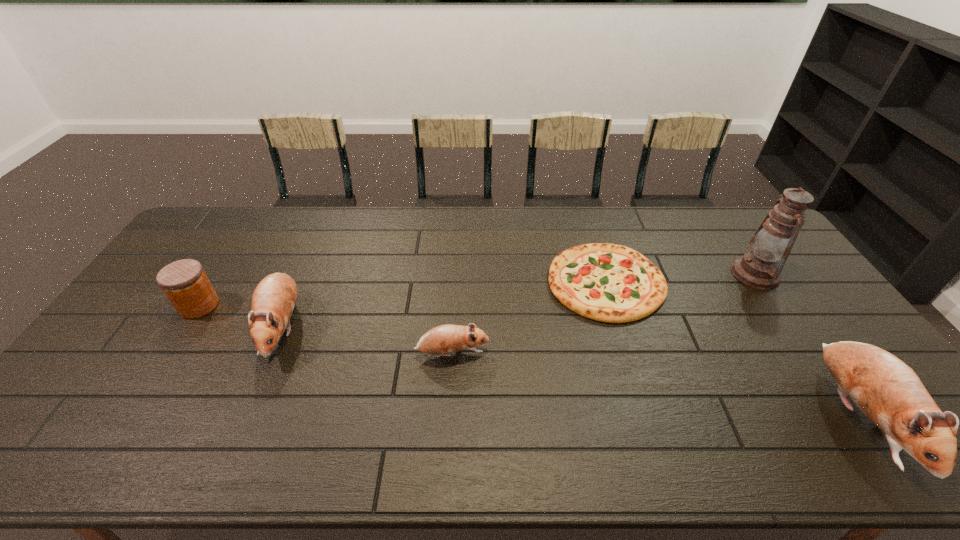
What are the coordinates of `free region located 0.270m at the face of the second shortest object` in the screenshot? It's located at (588, 353).

The width and height of the screenshot is (960, 540). I want to click on free point located 0.210m on the back of the jar, so click(235, 249).

Where is `vacant space situated on the left of the pizza`? Image resolution: width=960 pixels, height=540 pixels. vacant space situated on the left of the pizza is located at coordinates (436, 282).

The width and height of the screenshot is (960, 540). I want to click on vacant space situated 0.380m on the left of the oil lamp, so click(x=615, y=274).

Identify the location of object located in the near edge section of the desktop. (885, 389).

You are a GUI agent. You are given a task and a screenshot of the screen. Output one action in this format:
    pyautogui.click(x=<x>, y=<y>)
    Task: Click on the object that is at the left edge
    The image size is (960, 540).
    Given the screenshot: What is the action you would take?
    pyautogui.click(x=184, y=282)

Locate an element on the screen. The height and width of the screenshot is (540, 960). hamster at the right edge is located at coordinates (885, 389).

Find the location of a particular element. Image resolution: width=960 pixels, height=540 pixels. oil lamp that is at the right edge is located at coordinates (760, 268).

Find the location of a particular element. object that is at the near right corner is located at coordinates (885, 389).

The height and width of the screenshot is (540, 960). I want to click on vacant region at the far edge of the desktop, so click(332, 234).